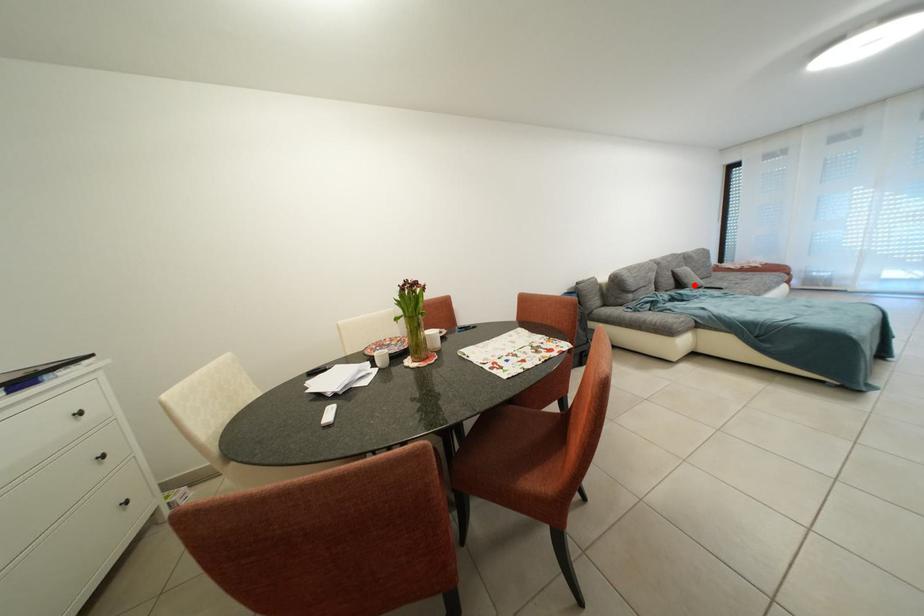
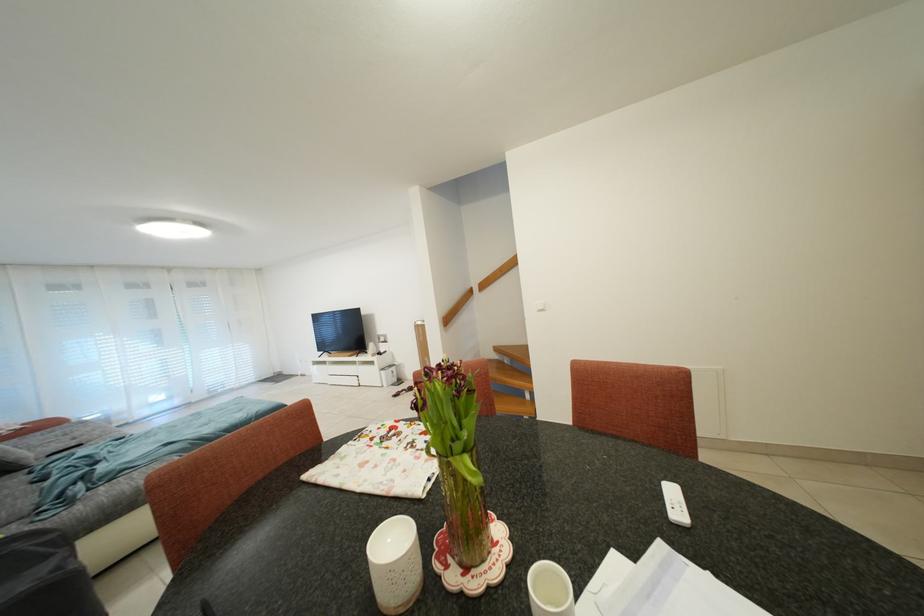
In the second image, find the point that corresponds to the highlighted location in the first image.

(19, 462)